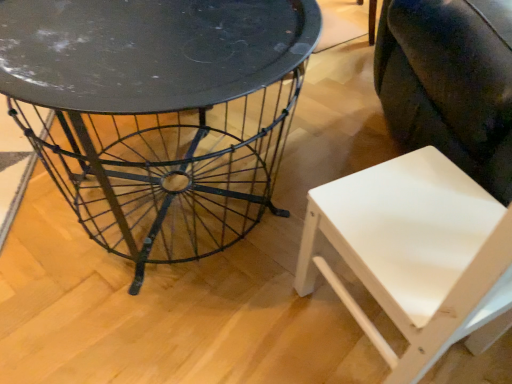
Locate an element on the screen. metallic wire table at center is located at coordinates (158, 113).

You are a GUI agent. You are given a task and a screenshot of the screen. Output one action in this format:
    pyautogui.click(x=<x>, y=<y>)
    Task: Click on the white matte swivel chair at lower right
    The height and width of the screenshot is (384, 512).
    Given the screenshot: What is the action you would take?
    pyautogui.click(x=450, y=82)

Based on the photo, which is more to the right, metallic wire table at center or white matte swivel chair at lower right?

white matte swivel chair at lower right is more to the right.

Is the position of metallic wire table at center less distant than that of white matte swivel chair at lower right?

No, metallic wire table at center is behind white matte swivel chair at lower right.

From a real-world perspective, between metallic wire table at center and white matte swivel chair at lower right, who is vertically higher?

In real-world perspective, white matte swivel chair at lower right is above.

Is white matte swivel chair at lower right positioned before white matte chair at lower right?

No, white matte swivel chair at lower right is behind white matte chair at lower right.

From the image's perspective, is white matte swivel chair at lower right over white matte chair at lower right?

Correct, white matte swivel chair at lower right appears higher than white matte chair at lower right in the image.

Does white matte swivel chair at lower right have a greater height compared to white matte chair at lower right?

Yes, white matte swivel chair at lower right is taller than white matte chair at lower right.

Is white matte chair at lower right surrounding metallic wire table at center?

No, metallic wire table at center is not surrounded by white matte chair at lower right.

In order to click on chair that is on the right side of metallic wire table at center in this screenshot , I will do `click(416, 255)`.

Is white matte chair at lower right not close to metallic wire table at center?

Actually, white matte chair at lower right and metallic wire table at center are a little close together.

In the scene shown: Is the depth of white matte chair at lower right less than that of metallic wire table at center?

Yes, white matte chair at lower right is in front of metallic wire table at center.

Does point (429, 308) come farther from viewer compared to point (473, 16)?

That is False.

From the image's perspective, is white matte chair at lower right over white matte swivel chair at lower right?

No.

Is white matte chair at lower right next to white matte swivel chair at lower right?

They are not placed beside each other.

Considering the relative sizes of white matte chair at lower right and white matte swivel chair at lower right in the image provided, is white matte chair at lower right taller than white matte swivel chair at lower right?

Incorrect, the height of white matte chair at lower right is not larger of that of white matte swivel chair at lower right.

Is white matte swivel chair at lower right shorter than metallic wire table at center?

In fact, white matte swivel chair at lower right may be taller than metallic wire table at center.

Which of these two, white matte swivel chair at lower right or metallic wire table at center, is thinner?

Thinner between the two is white matte swivel chair at lower right.

Based on the photo, is white matte swivel chair at lower right turned away from metallic wire table at center?

No, metallic wire table at center is not at the back of white matte swivel chair at lower right.

Is white matte swivel chair at lower right bigger than metallic wire table at center?

Correct, white matte swivel chair at lower right is larger in size than metallic wire table at center.

Consider the image. From a real-world perspective, does metallic wire table at center stand above white matte chair at lower right?

No.

Is metallic wire table at center completely or partially outside of white matte chair at lower right?

metallic wire table at center is positioned outside white matte chair at lower right.

Is metallic wire table at center with white matte chair at lower right?

No, metallic wire table at center is not touching white matte chair at lower right.

Find the location of a particular element. The image size is (512, 384). table located underneath the white matte swivel chair at lower right (from a real-world perspective) is located at coordinates (158, 113).

I want to click on chair below the white matte swivel chair at lower right (from the image's perspective), so click(x=416, y=255).

Estimate the real-world distances between objects in this image. Which object is further from white matte swivel chair at lower right, metallic wire table at center or white matte chair at lower right?

Based on the image, metallic wire table at center appears to be further to white matte swivel chair at lower right.

Considering their positions, is white matte chair at lower right positioned closer to metallic wire table at center than white matte swivel chair at lower right?

The object closer to metallic wire table at center is white matte chair at lower right.

When comparing their distances from white matte chair at lower right, does metallic wire table at center or white matte swivel chair at lower right seem further?

metallic wire table at center is positioned further to the anchor white matte chair at lower right.

Which object lies further to the anchor point white matte chair at lower right, white matte swivel chair at lower right or metallic wire table at center?

metallic wire table at center is positioned further to the anchor white matte chair at lower right.

Looking at the image, which one is located closer to metallic wire table at center, white matte swivel chair at lower right or white matte chair at lower right?

Based on the image, white matte chair at lower right appears to be nearer to metallic wire table at center.

When comparing their distances from white matte swivel chair at lower right, does white matte chair at lower right or metallic wire table at center seem closer?

white matte chair at lower right lies closer to white matte swivel chair at lower right than the other object.

This screenshot has width=512, height=384. What are the coordinates of `chair situated between metallic wire table at center and white matte swivel chair at lower right from left to right` in the screenshot? It's located at (416, 255).